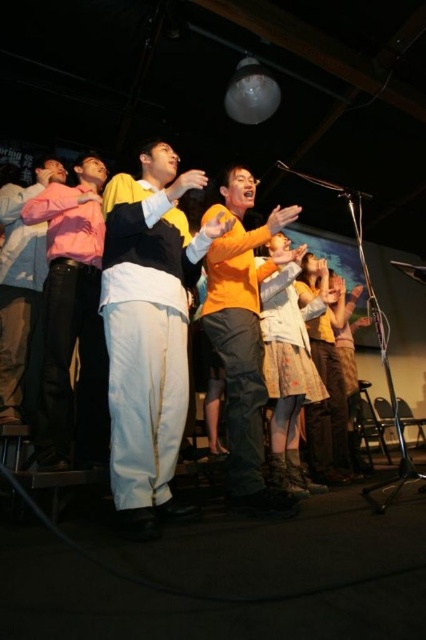
Question: Which point is farther to the camera?

Choices:
 (A) pink matte shirt at left
 (B) white cotton pants at center

Answer: (A)

Question: Based on their relative distances, which object is nearer to the orange matte shirt at center?

Choices:
 (A) pink matte shirt at left
 (B) white cotton pants at center

Answer: (B)

Question: Where is pink matte shirt at left located in relation to orange matte shirt at center in the image?

Choices:
 (A) above
 (B) below

Answer: (A)

Question: Can you confirm if pink matte shirt at left is wider than orange matte shirt at center?

Choices:
 (A) no
 (B) yes

Answer: (B)

Question: Which object is positioned closest to the orange matte shirt at center?

Choices:
 (A) pink matte shirt at left
 (B) white cotton pants at center

Answer: (B)

Question: Can you confirm if white cotton pants at center is wider than pink matte shirt at left?

Choices:
 (A) yes
 (B) no

Answer: (A)